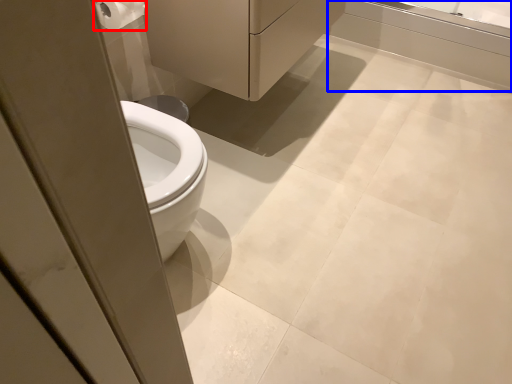
Question: Which object is closer to the camera taking this photo, toilet paper (highlighted by a red box) or bath (highlighted by a blue box)?

Choices:
 (A) toilet paper
 (B) bath

Answer: (A)